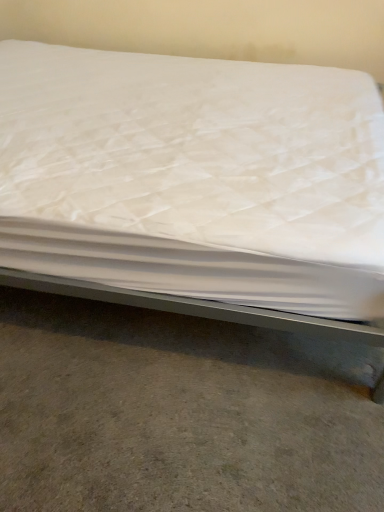
This screenshot has height=512, width=384. What do you see at coordinates (173, 415) in the screenshot?
I see `gray concrete floor at lower center` at bounding box center [173, 415].

The image size is (384, 512). In order to click on gray concrete floor at lower center in this screenshot , I will do `click(173, 415)`.

Image resolution: width=384 pixels, height=512 pixels. Identify the location of white quilted mattress at center. (194, 185).

What is the approximate height of white quilted mattress at center?

The height of white quilted mattress at center is 35.41 inches.

What do you see at coordinates (194, 185) in the screenshot? I see `white quilted mattress at center` at bounding box center [194, 185].

Identify the location of gray concrete floor at lower center. (173, 415).

Considering the positions of objects gray concrete floor at lower center and white quilted mattress at center in the image provided, who is more to the right, gray concrete floor at lower center or white quilted mattress at center?

From the viewer's perspective, gray concrete floor at lower center appears more on the right side.

Is gray concrete floor at lower center in front of white quilted mattress at center?

No, it is not.

Considering the positions of points (222, 417) and (148, 121), is point (222, 417) closer to camera compared to point (148, 121)?

Yes, it is.

From the image's perspective, is gray concrete floor at lower center under white quilted mattress at center?

Correct, gray concrete floor at lower center appears lower than white quilted mattress at center in the image.

In the scene shown: From a real-world perspective, which object stands above the other?

white quilted mattress at center, from a real-world perspective.

Considering the sizes of gray concrete floor at lower center and white quilted mattress at center in the image, is gray concrete floor at lower center wider or thinner than white quilted mattress at center?

Considering their sizes, gray concrete floor at lower center looks slimmer than white quilted mattress at center.

Between gray concrete floor at lower center and white quilted mattress at center, which one has more height?

Standing taller between the two is white quilted mattress at center.

Does gray concrete floor at lower center have a smaller size compared to white quilted mattress at center?

Yes.

Is gray concrete floor at lower center not inside white quilted mattress at center?

gray concrete floor at lower center lies outside white quilted mattress at center's area.

Would you consider gray concrete floor at lower center to be distant from white quilted mattress at center?

That's not correct — gray concrete floor at lower center is a little close to white quilted mattress at center.

Is gray concrete floor at lower center aimed at white quilted mattress at center?

No, gray concrete floor at lower center is not facing towards white quilted mattress at center.

This screenshot has height=512, width=384. In order to click on concrete below the white quilted mattress at center (from the image's perspective) in this screenshot , I will do `click(173, 415)`.

Considering the relative positions of white quilted mattress at center and gray concrete floor at lower center in the image provided, is white quilted mattress at center to the left or to the right of gray concrete floor at lower center?

white quilted mattress at center is to the left of gray concrete floor at lower center.

Between white quilted mattress at center and gray concrete floor at lower center, which one is positioned in front?

white quilted mattress at center is more forward.

Is point (267, 301) closer or farther from the camera than point (223, 448)?

Point (267, 301) is positioned closer to the camera compared to point (223, 448).

From the image's perspective, is white quilted mattress at center located beneath gray concrete floor at lower center?

No, from the image's perspective, white quilted mattress at center is not beneath gray concrete floor at lower center.

From a real-world perspective, is white quilted mattress at center below gray concrete floor at lower center?

No, from a real-world perspective, white quilted mattress at center is not below gray concrete floor at lower center.

Can you confirm if white quilted mattress at center is thinner than gray concrete floor at lower center?

No.

From their relative heights in the image, would you say white quilted mattress at center is taller or shorter than gray concrete floor at lower center?

In the image, white quilted mattress at center appears to be taller than gray concrete floor at lower center.

Between white quilted mattress at center and gray concrete floor at lower center, which one has larger size?

white quilted mattress at center.

Choose the correct answer: Is white quilted mattress at center inside gray concrete floor at lower center or outside it?

white quilted mattress at center is spatially situated outside gray concrete floor at lower center.

Are white quilted mattress at center and gray concrete floor at lower center far apart?

Actually, white quilted mattress at center and gray concrete floor at lower center are a little close together.

Is white quilted mattress at center facing towards gray concrete floor at lower center?

No, white quilted mattress at center is not turned towards gray concrete floor at lower center.

In the image, there is a white quilted mattress at center. Where is `concrete below it (from the image's perspective)`? The height and width of the screenshot is (512, 384). concrete below it (from the image's perspective) is located at coordinates (173, 415).

Locate an element on the screen. bed on the left of the gray concrete floor at lower center is located at coordinates (194, 185).

You are a GUI agent. You are given a task and a screenshot of the screen. Output one action in this format:
    pyautogui.click(x=<x>, y=<y>)
    Task: Click on the bed located in front of the gray concrete floor at lower center
    The image size is (384, 512).
    Given the screenshot: What is the action you would take?
    pyautogui.click(x=194, y=185)